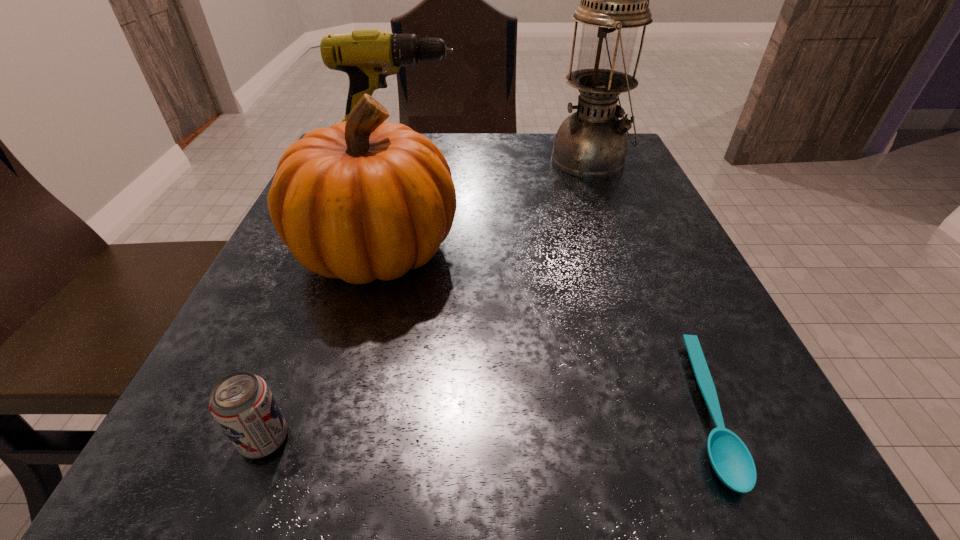
Locate an element on the screen. Image resolution: width=960 pixels, height=540 pixels. object located in the near left corner section of the desktop is located at coordinates (242, 404).

Locate an element on the screen. The image size is (960, 540). object at the far right corner is located at coordinates (591, 143).

Identify the location of object that is at the near right corner. (731, 460).

Image resolution: width=960 pixels, height=540 pixels. What are the coordinates of `vacant space at the far edge of the desktop` in the screenshot? It's located at (x=499, y=141).

In the image, there is a desktop. Identify the location of blank space at the near edge. (606, 457).

The image size is (960, 540). Find the location of `vacant space at the left edge`. vacant space at the left edge is located at coordinates (307, 309).

I want to click on blank space at the right edge, so click(x=675, y=401).

Locate an element on the screen. vacant space at the near left corner is located at coordinates (262, 491).

Where is `free space at the far right corner of the desktop`? Image resolution: width=960 pixels, height=540 pixels. free space at the far right corner of the desktop is located at coordinates (642, 176).

The image size is (960, 540). Identify the location of vacant space at the near right corner of the desktop. (763, 503).